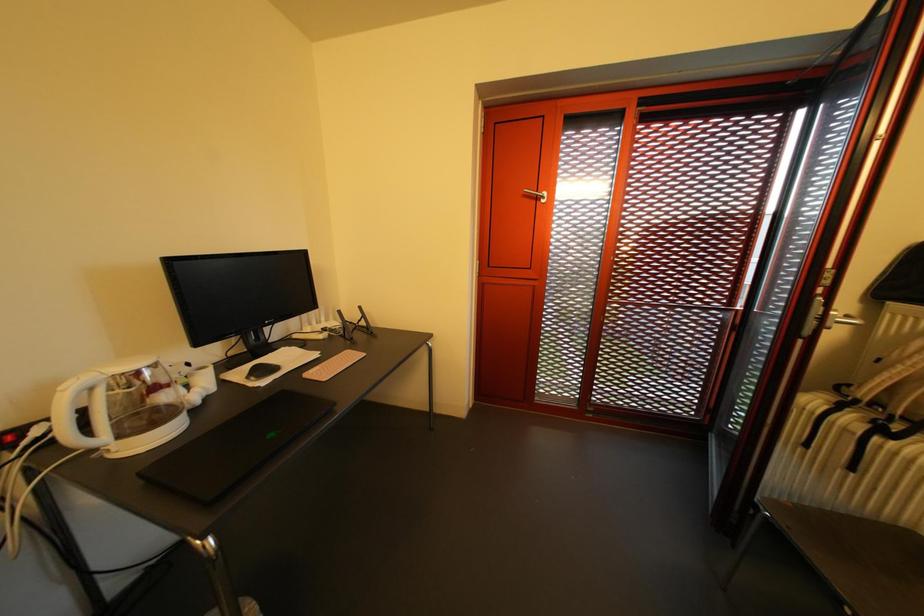
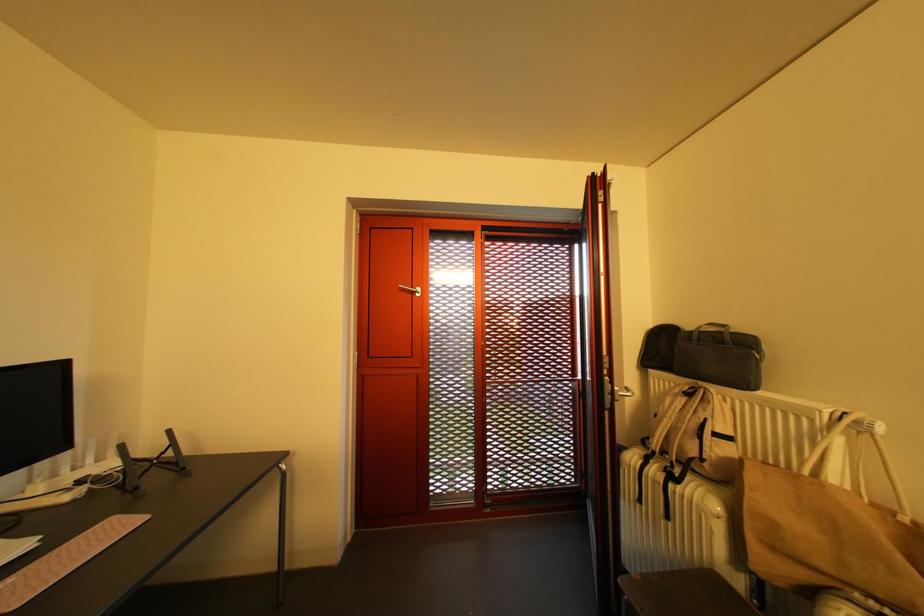
How did the camera likely rotate?

The rotation direction of the camera is right-up.